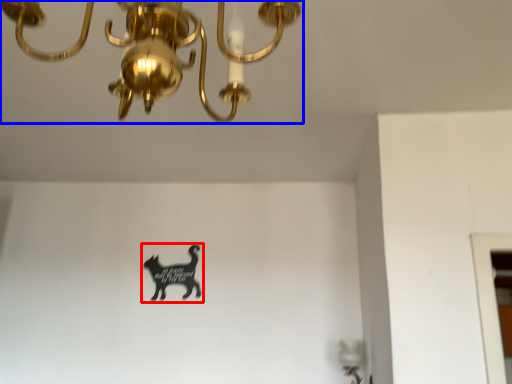
Question: Which object appears farthest to the camera in this image, animal (highlighted by a red box) or lamp (highlighted by a blue box)?

Choices:
 (A) animal
 (B) lamp

Answer: (A)